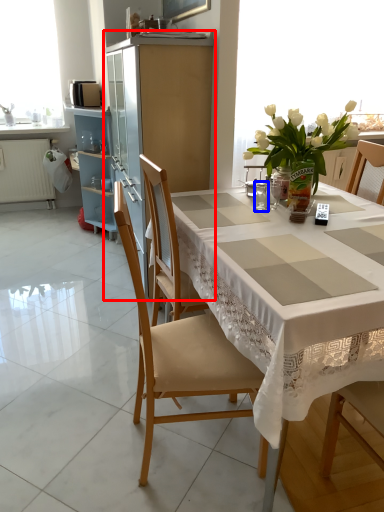
Question: Which of the following is the farthest to the observer, cabinetry (highlighted by a red box) or tableware (highlighted by a blue box)?

Choices:
 (A) cabinetry
 (B) tableware

Answer: (A)